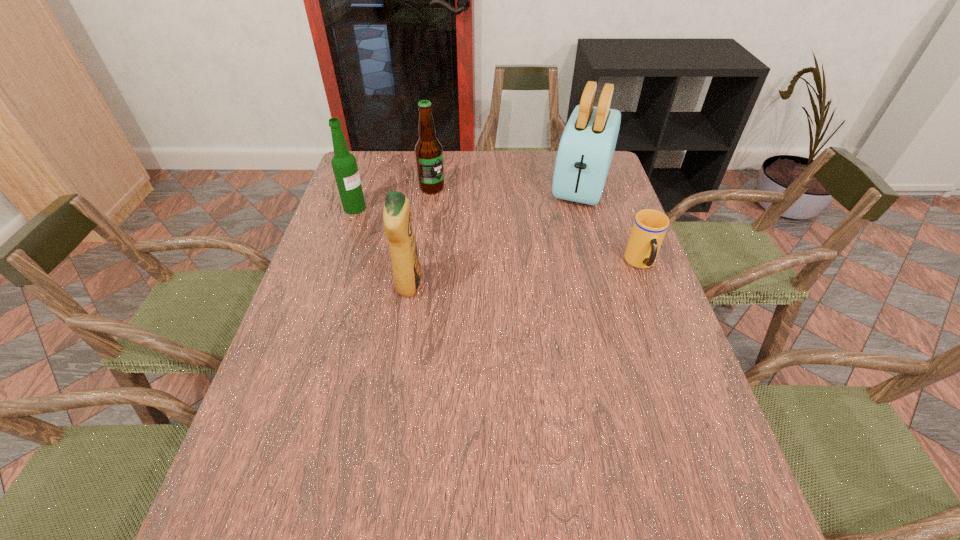
At what (x,y) coordinates should I click in order to perform the action: click on free space on the desktop that is between the detergent and the cup and is positioned on the side of the toaster with the lever. Please return your answer as a coordinate pair (x, y). Looking at the image, I should click on (550, 272).

Where is `free space on the desktop that is between the detergent and the cup and is positioned on the label of the right beer bottle`? free space on the desktop that is between the detergent and the cup and is positioned on the label of the right beer bottle is located at coordinates (526, 274).

The height and width of the screenshot is (540, 960). Find the location of `vacant space on the desktop that is between the detergent and the shortest object and is positioned on the label of the left beer bottle`. vacant space on the desktop that is between the detergent and the shortest object and is positioned on the label of the left beer bottle is located at coordinates (517, 275).